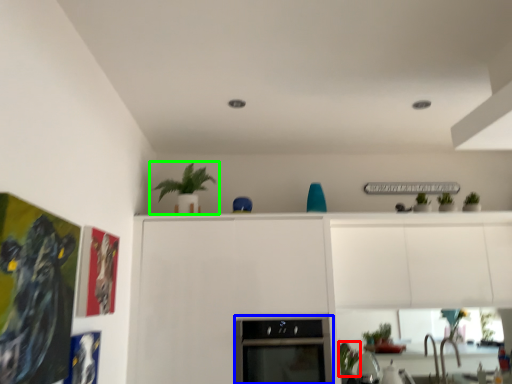
Question: Which is farther away from plant (highlighted by a red box)? oven (highlighted by a blue box) or houseplant (highlighted by a green box)?

Choices:
 (A) oven
 (B) houseplant

Answer: (B)